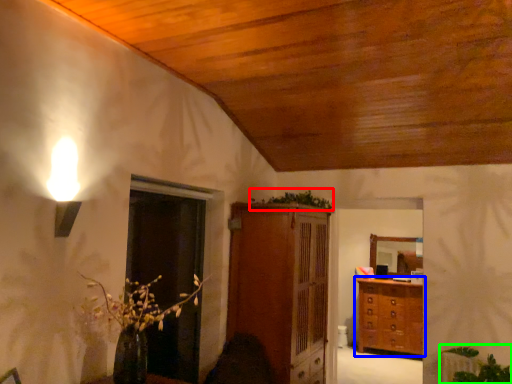
Question: Considering the real-world distances, which object is closest to plant (highlighted by a red box)? chest of drawers (highlighted by a blue box) or plant (highlighted by a green box).

Choices:
 (A) chest of drawers
 (B) plant

Answer: (A)